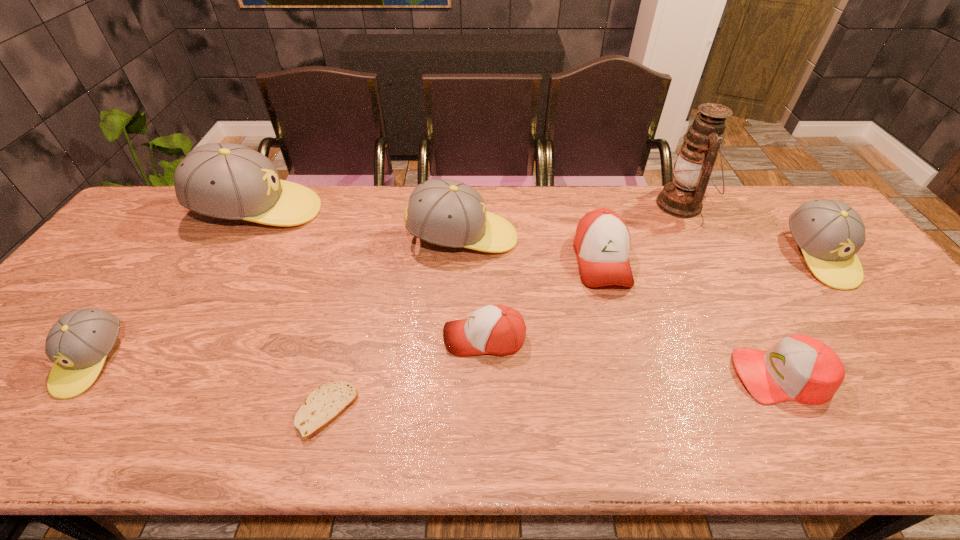
Identify the location of unoccupied area between the pita bread and the second tallest object. The width and height of the screenshot is (960, 540). (293, 311).

I want to click on empty space that is in between the smallest yellow baseball cap and the rightmost baseball cap, so [455, 309].

In order to click on vacant space that's between the fourth object from right to left and the tallest object in this screenshot , I will do `click(641, 233)`.

Where is `blank region between the eighth shortest object and the nearer orange baseball cap`? Image resolution: width=960 pixels, height=540 pixels. blank region between the eighth shortest object and the nearer orange baseball cap is located at coordinates (372, 275).

Where is `unoccupied position between the rightmost yellow baseball cap and the sixth baseball cap from left to right`? Image resolution: width=960 pixels, height=540 pixels. unoccupied position between the rightmost yellow baseball cap and the sixth baseball cap from left to right is located at coordinates (800, 316).

This screenshot has height=540, width=960. What are the coordinates of `object that ranks as the fifth closest to the bigger orange baseball cap` in the screenshot? It's located at (829, 232).

This screenshot has height=540, width=960. Identify the location of object that stands as the fourth closest to the lantern. (445, 212).

Identify the location of baseball cap identified as the closest to the nearest yellow baseball cap. (229, 181).

Locate an element on the screen. baseball cap that can be found as the fifth closest to the seventh object from right to left is located at coordinates (602, 241).

You are a GUI agent. You are given a task and a screenshot of the screen. Output one action in this format:
    pyautogui.click(x=<x>, y=<y>)
    Task: Click on the yellow baseball cap that stands as the third closest to the rightmost yellow baseball cap
    
    Given the screenshot: What is the action you would take?
    pyautogui.click(x=78, y=343)